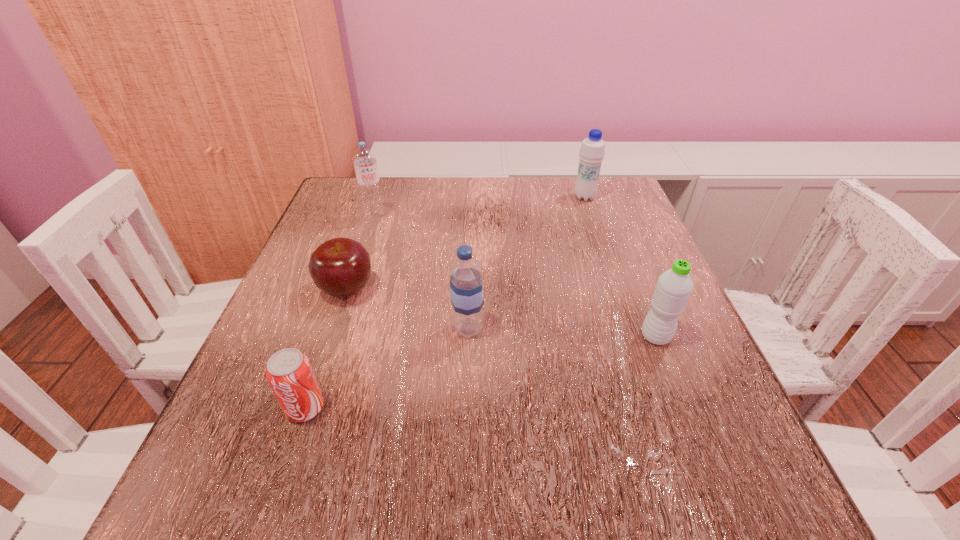
Locate which water bottle ranks third in proximity to the farthest object. Please provide its 2D coordinates. Your answer should be formatted as a tuple, i.e. [(x, y)], where the tuple contains the x and y coordinates of a point satisfying the conditions above.

[(364, 159)]

In order to click on the second closest water bottle to the farthest object in this screenshot , I will do `click(466, 288)`.